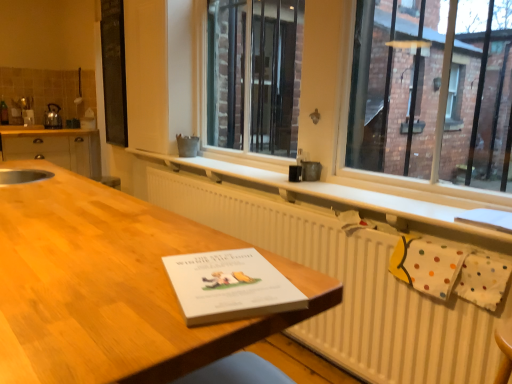
Question: From a real-world perspective, is matte wood cabinets at left located beneath black matte board at upper left?

Choices:
 (A) yes
 (B) no

Answer: (A)

Question: Are matte wood cabinets at left and black matte board at upper left beside each other?

Choices:
 (A) yes
 (B) no

Answer: (B)

Question: Considering the relative sizes of matte wood cabinets at left and black matte board at upper left in the image provided, is matte wood cabinets at left shorter than black matte board at upper left?

Choices:
 (A) yes
 (B) no

Answer: (A)

Question: Considering the relative sizes of matte wood cabinets at left and black matte board at upper left in the image provided, is matte wood cabinets at left wider than black matte board at upper left?

Choices:
 (A) yes
 (B) no

Answer: (A)

Question: Considering the relative sizes of matte wood cabinets at left and black matte board at upper left in the image provided, is matte wood cabinets at left taller than black matte board at upper left?

Choices:
 (A) yes
 (B) no

Answer: (B)

Question: Is matte wood cabinets at left closer to the viewer compared to black matte board at upper left?

Choices:
 (A) no
 (B) yes

Answer: (A)

Question: Is wooden table at center positioned beyond the bounds of metallic silver kettle at left?

Choices:
 (A) no
 (B) yes

Answer: (B)

Question: From a real-world perspective, is wooden table at center positioned under metallic silver kettle at left based on gravity?

Choices:
 (A) yes
 (B) no

Answer: (A)

Question: Would you say metallic silver kettle at left is part of wooden table at center's contents?

Choices:
 (A) yes
 (B) no

Answer: (B)

Question: Does wooden table at center have a greater width compared to metallic silver kettle at left?

Choices:
 (A) no
 (B) yes

Answer: (B)

Question: Is wooden table at center with metallic silver kettle at left?

Choices:
 (A) yes
 (B) no

Answer: (B)

Question: Is wooden table at center turned away from metallic silver kettle at left?

Choices:
 (A) yes
 (B) no

Answer: (B)

Question: Is metallic silver kettle at left outside white textured radiator at center?

Choices:
 (A) no
 (B) yes

Answer: (B)